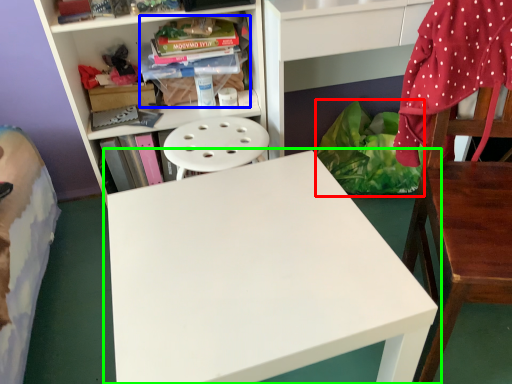
Question: Which is farther away from material (highlighted by a red box)? book (highlighted by a blue box) or table (highlighted by a green box)?

Choices:
 (A) book
 (B) table

Answer: (B)